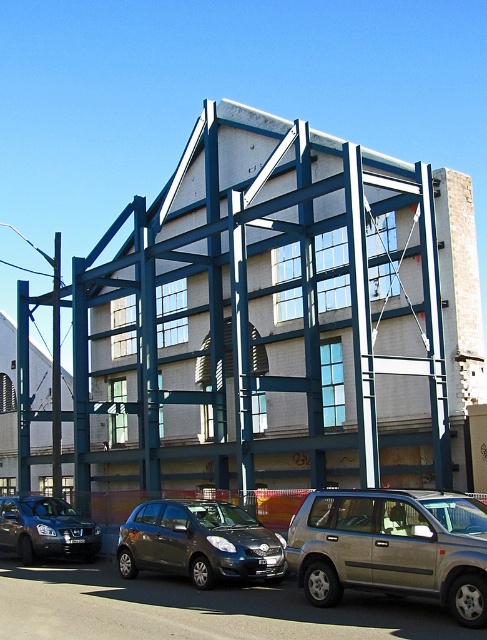
Can you confirm if blue metallic scaffolding at center is shorter than matte black sedan at lower left?

No.

Does blue metallic scaffolding at center appear over matte black sedan at lower left?

Indeed, blue metallic scaffolding at center is positioned over matte black sedan at lower left.

Where is `blue metallic scaffolding at center`? blue metallic scaffolding at center is located at coordinates (262, 316).

Where is `blue metallic scaffolding at center`? blue metallic scaffolding at center is located at coordinates (262, 316).

Who is positioned more to the left, satin dark gray hatchback at center or matte black sedan at lower left?

matte black sedan at lower left is more to the left.

The image size is (487, 640). What do you see at coordinates (199, 541) in the screenshot?
I see `satin dark gray hatchback at center` at bounding box center [199, 541].

Where is `satin dark gray hatchback at center`? Image resolution: width=487 pixels, height=640 pixels. satin dark gray hatchback at center is located at coordinates (199, 541).

Does gold metallic suv at center have a greater width compared to satin dark gray hatchback at center?

No.

Is gold metallic suv at center bigger than satin dark gray hatchback at center?

No.

Is point (422, 576) behind point (239, 534)?

No.

Where is `gold metallic suv at center`? Image resolution: width=487 pixels, height=640 pixels. gold metallic suv at center is located at coordinates (393, 547).